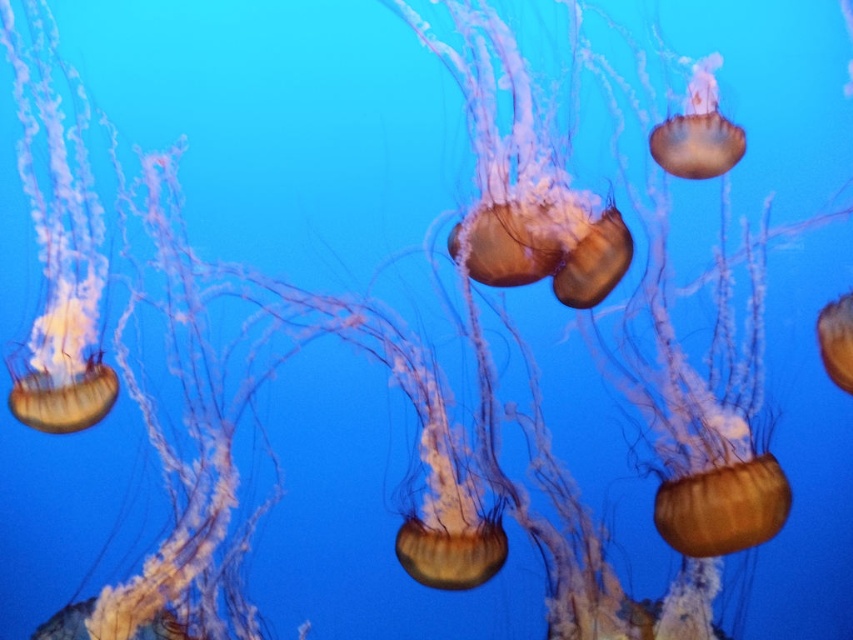
Is translucent gelatinous at left bigger than translucent golden jellyfish at right?

Indeed, translucent gelatinous at left has a larger size compared to translucent golden jellyfish at right.

Does point (68, 204) come farther from viewer compared to point (846, 385)?

Yes, it is.

The image size is (853, 640). Identify the location of translucent gelatinous at left. (57, 252).

Between translucent gelatinous at left and translucent golden jellyfish at upper right, which one is positioned higher?

translucent golden jellyfish at upper right

Can you confirm if translucent gelatinous at left is taller than translucent golden jellyfish at upper right?

Correct, translucent gelatinous at left is much taller as translucent golden jellyfish at upper right.

Describe the element at coordinates (57, 252) in the screenshot. I see `translucent gelatinous at left` at that location.

Find the location of `translucent gelatinous at left`. translucent gelatinous at left is located at coordinates (57, 252).

Does point (705, 176) come behind point (848, 371)?

Yes, it is behind point (848, 371).

Does point (653, 156) come closer to viewer compared to point (845, 352)?

No.

Which is in front, point (685, 170) or point (842, 364)?

Point (842, 364) is more forward.

Image resolution: width=853 pixels, height=640 pixels. In order to click on translucent golden jellyfish at upper right in this screenshot , I will do `click(698, 131)`.